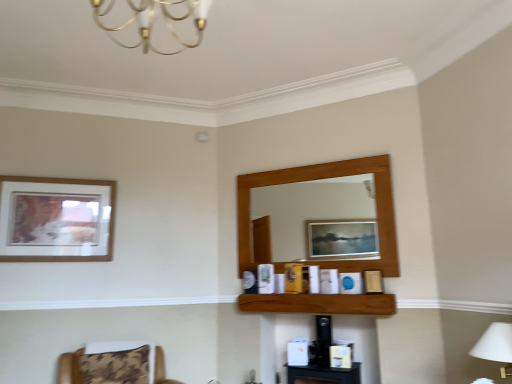
Question: Is brown wooden shelf at center wider or thinner than gold metallic chandelier at upper center?

Choices:
 (A) thin
 (B) wide

Answer: (A)

Question: From the image's perspective, relative to gold metallic chandelier at upper center, is brown wooden shelf at center above or below?

Choices:
 (A) below
 (B) above

Answer: (A)

Question: Which is nearer to the white fabric lampshade at lower right?

Choices:
 (A) brown wooden shelf at center
 (B) gold metallic chandelier at upper center
 (C) wooden picture frame at upper left
 (D) brown fabric chair at lower left

Answer: (A)

Question: Which of these objects is positioned closest to the brown wooden shelf at center?

Choices:
 (A) wooden picture frame at upper left
 (B) white fabric lampshade at lower right
 (C) gold metallic chandelier at upper center
 (D) brown fabric chair at lower left

Answer: (B)